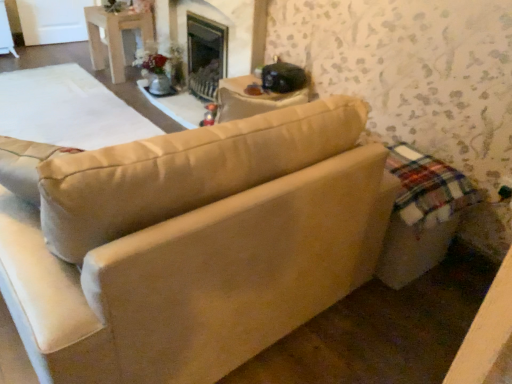
What do you see at coordinates (116, 35) in the screenshot? The width and height of the screenshot is (512, 384). I see `white wood table at upper left` at bounding box center [116, 35].

Locate an element on the screen. white wood table at upper left is located at coordinates (116, 35).

What is the approximate width of beige fabric couch at center?

It is 3.40 feet.

In order to click on beige fabric couch at center in this screenshot , I will do `click(193, 244)`.

Describe the element at coordinates (193, 244) in the screenshot. I see `beige fabric couch at center` at that location.

Identify the location of white wood table at upper left. (116, 35).

Between white wood table at upper left and beige fabric couch at center, which one appears on the left side from the viewer's perspective?

white wood table at upper left is more to the left.

Considering their positions, is white wood table at upper left located in front of or behind beige fabric couch at center?

Clearly, white wood table at upper left is behind beige fabric couch at center.

Is point (153, 41) positioned in front of point (83, 354)?

No, (153, 41) is further to viewer.

From the image's perspective, would you say white wood table at upper left is positioned over beige fabric couch at center?

Correct, white wood table at upper left appears higher than beige fabric couch at center in the image.

From a real-world perspective, relative to beige fabric couch at center, is white wood table at upper left vertically above or below?

white wood table at upper left is situated lower than beige fabric couch at center in the real world.

From the picture: In terms of width, does white wood table at upper left look wider or thinner when compared to beige fabric couch at center?

Considering their sizes, white wood table at upper left looks slimmer than beige fabric couch at center.

Is white wood table at upper left shorter than beige fabric couch at center?

Correct, white wood table at upper left is not as tall as beige fabric couch at center.

Who is bigger, white wood table at upper left or beige fabric couch at center?

With larger size is beige fabric couch at center.

Which is correct: white wood table at upper left is inside beige fabric couch at center, or outside of it?

white wood table at upper left is spatially situated outside beige fabric couch at center.

Is white wood table at upper left next to beige fabric couch at center and touching it?

No, white wood table at upper left is not beside beige fabric couch at center.

Does white wood table at upper left turn towards beige fabric couch at center?

No, white wood table at upper left is not facing towards beige fabric couch at center.

How many degrees apart are the facing directions of white wood table at upper left and beige fabric couch at center?

87.6 degrees separate the facing orientations of white wood table at upper left and beige fabric couch at center.

Image resolution: width=512 pixels, height=384 pixels. Identify the location of studio couch to the right of white wood table at upper left. (193, 244).

Visually, is beige fabric couch at center positioned to the left or to the right of white wood table at upper left?

beige fabric couch at center is positioned on white wood table at upper left's right side.

Relative to white wood table at upper left, is beige fabric couch at center in front or behind?

In the image, beige fabric couch at center appears in front of white wood table at upper left.

Is point (60, 382) positioned behind point (109, 24)?

No, (60, 382) is in front of (109, 24).

From the image's perspective, would you say beige fabric couch at center is shown under white wood table at upper left?

Yes, from the image's perspective, beige fabric couch at center is below white wood table at upper left.

From a real-world perspective, which is physically below, beige fabric couch at center or white wood table at upper left?

From a 3D spatial view, white wood table at upper left is below.

Between beige fabric couch at center and white wood table at upper left, which one has smaller width?

white wood table at upper left is thinner.

Considering the relative sizes of beige fabric couch at center and white wood table at upper left in the image provided, is beige fabric couch at center shorter than white wood table at upper left?

In fact, beige fabric couch at center may be taller than white wood table at upper left.

Which of these two, beige fabric couch at center or white wood table at upper left, is smaller?

white wood table at upper left is smaller.

Is white wood table at upper left completely or partially inside beige fabric couch at center?

Definitely not — white wood table at upper left is not inside beige fabric couch at center.

Is beige fabric couch at center far from white wood table at upper left?

Indeed, beige fabric couch at center is not near white wood table at upper left.

From the picture: Is beige fabric couch at center turned away from white wood table at upper left?

No, white wood table at upper left is not at the back of beige fabric couch at center.

How many degrees apart are the facing directions of beige fabric couch at center and white wood table at upper left?

The facing directions of beige fabric couch at center and white wood table at upper left are 87.6 degrees apart.

You are a GUI agent. You are given a task and a screenshot of the screen. Output one action in this format:
    pyautogui.click(x=<x>, y=<y>)
    Task: Click on the studio couch that appears in front of the white wood table at upper left
    The width and height of the screenshot is (512, 384).
    Given the screenshot: What is the action you would take?
    pyautogui.click(x=193, y=244)

Locate an element on the screen. This screenshot has height=384, width=512. studio couch that is in front of the white wood table at upper left is located at coordinates (193, 244).

Identify the location of studio couch above the white wood table at upper left (from a real-world perspective). The height and width of the screenshot is (384, 512). (193, 244).